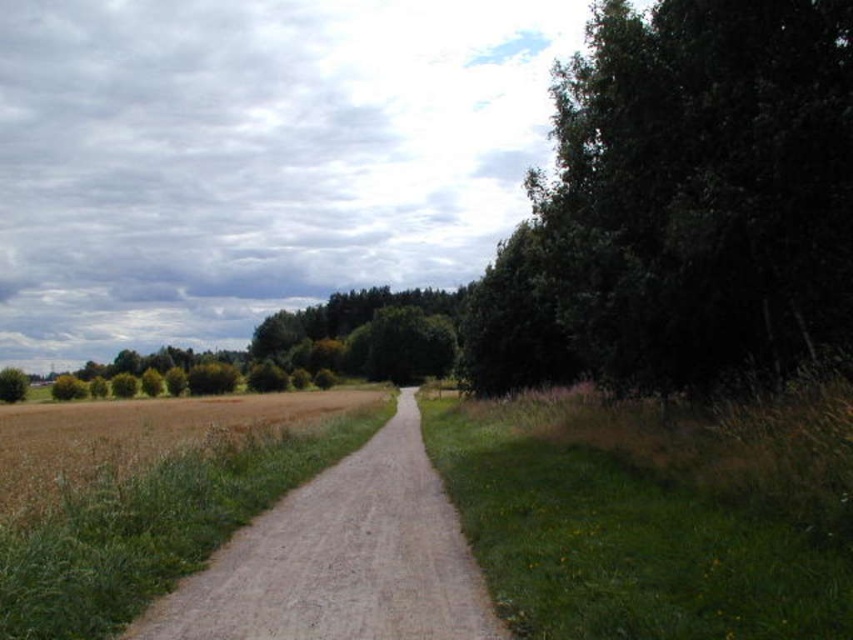
Question: Among these points, which one is nearest to the camera?

Choices:
 (A) (0, 397)
 (B) (801, 586)
 (C) (666, 8)
 (D) (398, 529)

Answer: (B)

Question: From the image, what is the correct spatial relationship of green leafy tree at right in relation to dirt/gravel path at center?

Choices:
 (A) left
 (B) right

Answer: (B)

Question: Where is green leafy tree at right located in relation to green leafy tree at left in the image?

Choices:
 (A) below
 (B) above

Answer: (B)

Question: Does dirt/gravel path at center have a greater width compared to green leafy tree at left?

Choices:
 (A) yes
 (B) no

Answer: (B)

Question: Which point is farther to the camera?

Choices:
 (A) green leafy tree at right
 (B) green grass at right

Answer: (A)

Question: Among these objects, which one is farthest from the camera?

Choices:
 (A) dirt/gravel path at center
 (B) green grass at right

Answer: (A)